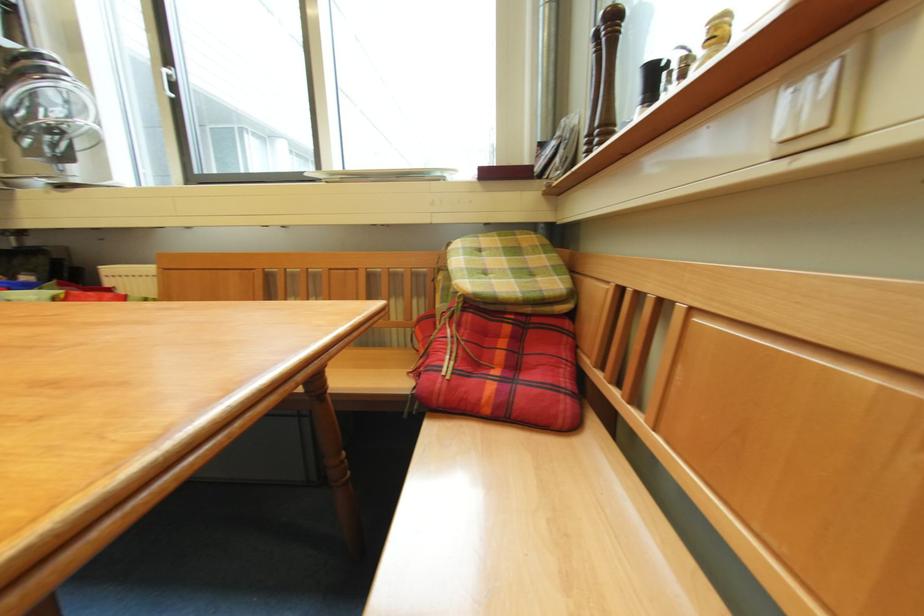
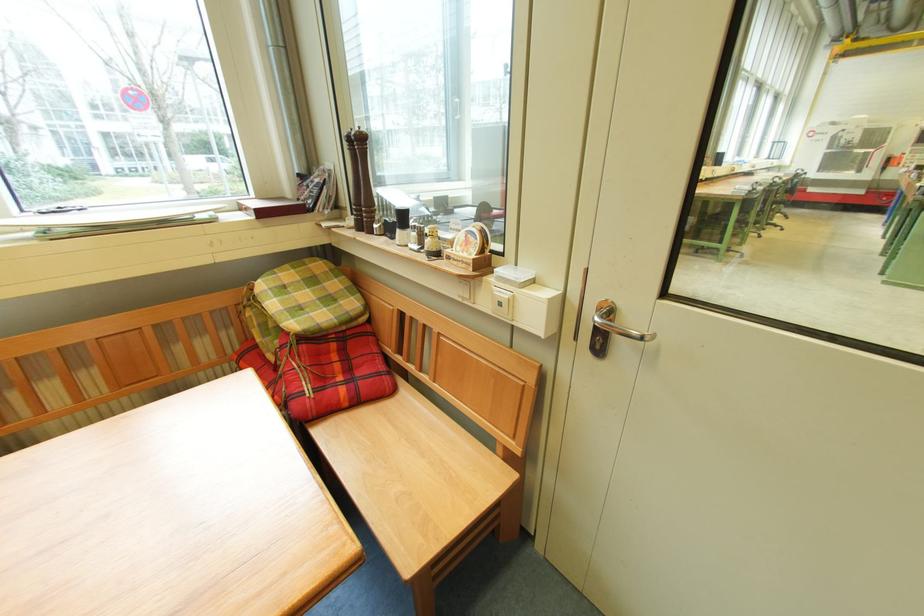
Where in the second image is the point corresponding to (580,437) from the first image?

(403, 397)